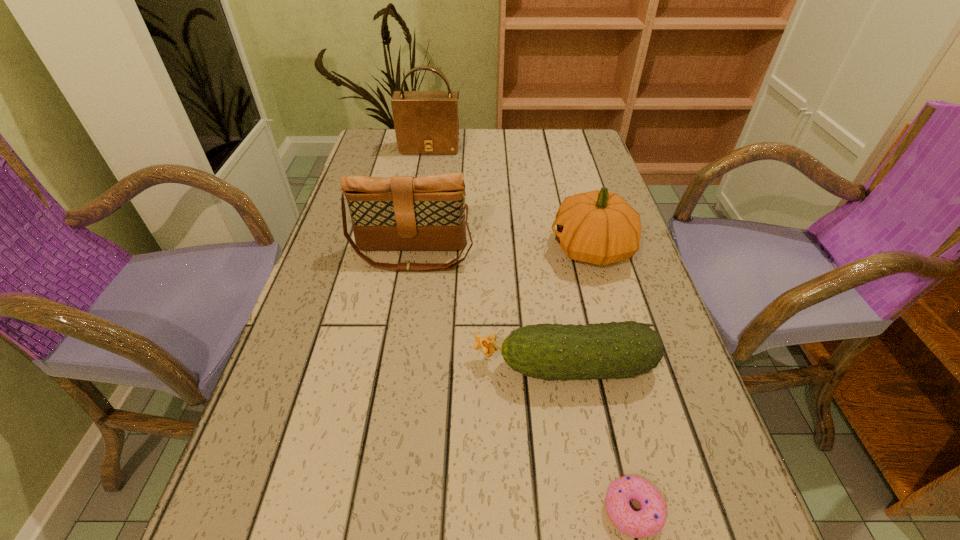
Find the location of `free spot located 0.070m on the side of the gourd with the carved face`. free spot located 0.070m on the side of the gourd with the carved face is located at coordinates (519, 248).

Locate an element on the screen. The height and width of the screenshot is (540, 960). vacant area situated on the side of the gourd with the carved face is located at coordinates (401, 248).

The image size is (960, 540). In order to click on vacant space located at the blossom end of the fourth tallest object in this screenshot , I will do `click(282, 366)`.

Find the location of a particular element. This screenshot has width=960, height=540. free spot located 0.290m at the blossom end of the fourth tallest object is located at coordinates (315, 366).

Find the location of a particular element. This screenshot has width=960, height=540. free space located at the blossom end of the fourth tallest object is located at coordinates (430, 366).

Image resolution: width=960 pixels, height=540 pixels. I want to click on object situated at the far edge, so click(426, 122).

Locate an element on the screen. Image resolution: width=960 pixels, height=540 pixels. gourd that is at the right edge is located at coordinates (599, 227).

Find the location of `cucumber that is at the right edge`. cucumber that is at the right edge is located at coordinates (616, 350).

The image size is (960, 540). I want to click on object that is at the far left corner, so click(426, 122).

This screenshot has height=540, width=960. In the image, there is a desktop. Find the location of `vacant area at the left edge`. vacant area at the left edge is located at coordinates (347, 293).